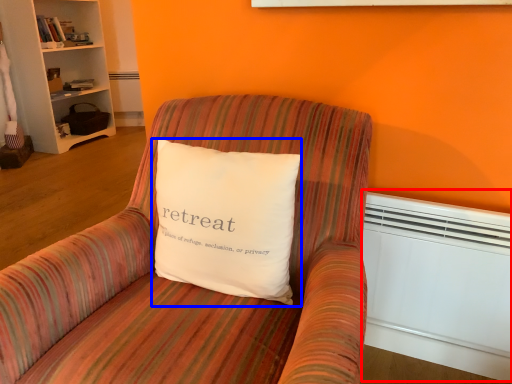
Question: Which object appears farthest to the camera in this image, heater (highlighted by a red box) or pillow (highlighted by a blue box)?

Choices:
 (A) heater
 (B) pillow

Answer: (A)